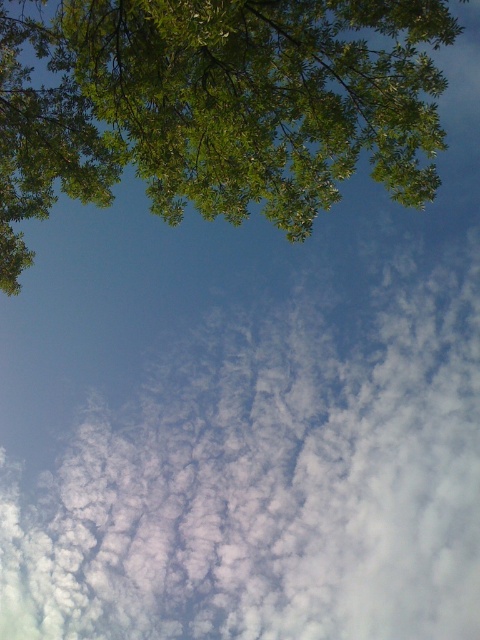
You are an astronomer analyzing the image and want to locate the white fluffy cloud at upper center. According to the coordinates, where is it positioned in the image?

The white fluffy cloud at upper center is located at the 2D coordinates point of (x=271, y=481).

You are an airplane pilot flying through the sky. You need to navigate between the white fluffy cloud at upper center and the green leafy tree at upper left. Which object is positioned lower in the scene?

The white fluffy cloud at upper center is located below the green leafy tree at upper left, so it is positioned lower in the scene.